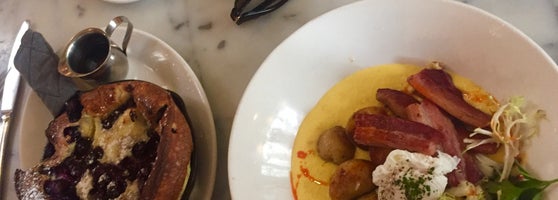
I want to click on tan plate, so click(153, 58).